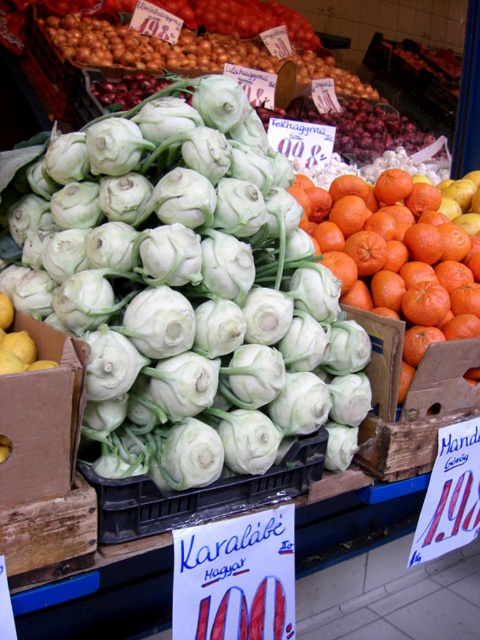
Question: Does white matte kohlrabi at center appear on the left side of yellow cardboard box at center-left?

Choices:
 (A) yes
 (B) no

Answer: (B)

Question: Can you confirm if white matte kohlrabi at center is wider than green leafy kohlrabi at center?

Choices:
 (A) no
 (B) yes

Answer: (A)

Question: Is white matte kohlrabi at center above yellow cardboard box at center-left?

Choices:
 (A) no
 (B) yes

Answer: (B)

Question: Which of these objects is positioned farthest from the white matte kohlrabi at center?

Choices:
 (A) green leafy kohlrabi at center
 (B) yellow cardboard box at center-left

Answer: (A)

Question: Estimate the real-world distances between objects in this image. Which object is farther from the white matte kohlrabi at center?

Choices:
 (A) green leafy kohlrabi at center
 (B) yellow cardboard box at center-left

Answer: (A)

Question: Which point appears farthest from the camera in this image?

Choices:
 (A) (235, 54)
 (B) (39, 305)

Answer: (A)